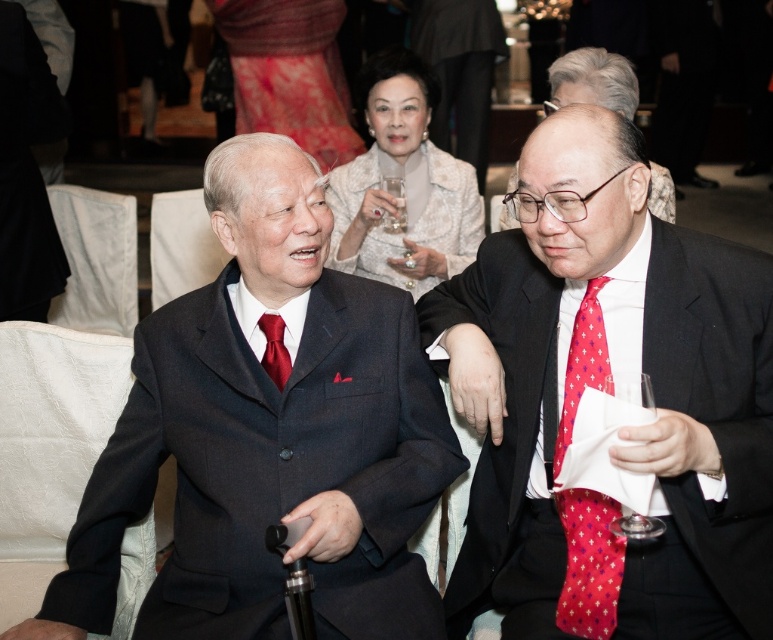
Can you confirm if matte black suit at right is wider than matte black suit at center?

No.

Where is `matte black suit at right`? The width and height of the screenshot is (773, 640). matte black suit at right is located at coordinates (598, 387).

Is matte black suit at center above silky red dress at upper center?

Incorrect, matte black suit at center is not positioned above silky red dress at upper center.

Is point (441, 401) behind point (305, 36)?

No, it is not.

Where is `matte black suit at center`? This screenshot has width=773, height=640. matte black suit at center is located at coordinates (268, 435).

Who is more distant from viewer, [554,285] or [649,516]?

The point [554,285] is behind.

Who is more forward, (540, 202) or (618, 384)?

Point (618, 384) is in front.

Locate an element on the screen. This screenshot has height=640, width=773. matte black suit at right is located at coordinates (598, 387).